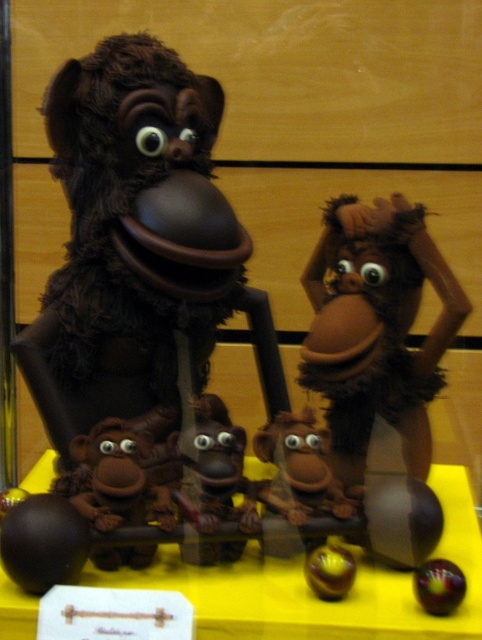
Is yellow matte table at center bigger than shiny purple ball at center?

Yes.

Which of these two, yellow matte table at center or shiny purple ball at center, stands shorter?

shiny purple ball at center is shorter.

What are the coordinates of `yellow matte table at center` in the screenshot? It's located at (312, 595).

Image resolution: width=482 pixels, height=640 pixels. Identify the location of yellow matte table at center. (x=312, y=595).

Does fuzzy brown puppet at center have a lesser height compared to yellow matte table at center?

No.

Looking at this image, can you confirm if fuzzy brown puppet at center is smaller than yellow matte table at center?

No, fuzzy brown puppet at center is not smaller than yellow matte table at center.

Identify the location of fuzzy brown puppet at center. The width and height of the screenshot is (482, 640). (137, 244).

From the picture: Does fuzzy brown puppet at center have a larger size compared to shiny purple ball at center?

Correct, fuzzy brown puppet at center is larger in size than shiny purple ball at center.

Is point (106, 230) closer to camera compared to point (444, 570)?

No, it is not.

Locate an element on the screen. This screenshot has height=640, width=482. fuzzy brown puppet at center is located at coordinates tap(137, 244).